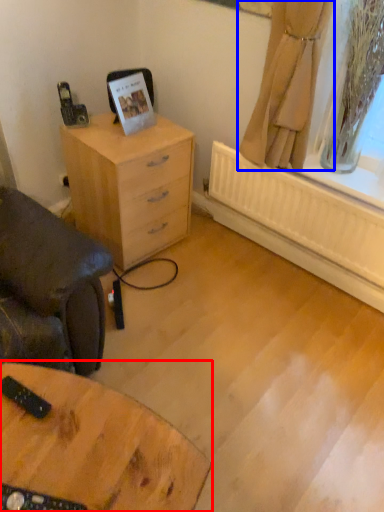
Question: Among these objects, which one is nearest to the camera, table (highlighted by a red box) or curtain (highlighted by a blue box)?

Choices:
 (A) table
 (B) curtain

Answer: (A)